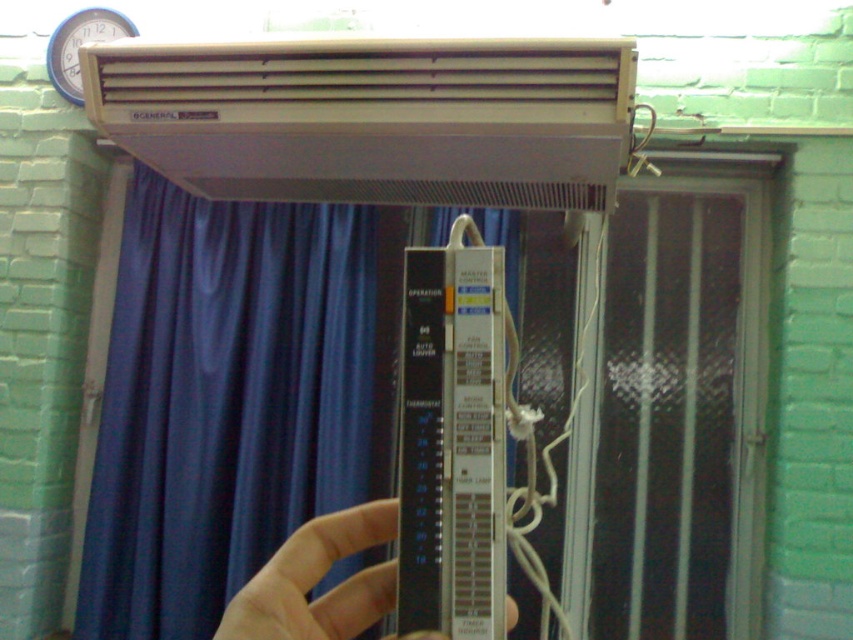
You are standing in the room and want to adjust the thermostat control device. Which object, the beige plastic air conditioner at upper center or the slightly translucent plastic at center, is closer to you?

The beige plastic air conditioner at upper center is closer to you because it is further to the viewer than the slightly translucent plastic at center.

You are standing in the room and want to adjust the air conditioning unit above the window. To do so, you need to move the blue satin curtain at center. Is the curtain in a position that allows you to reach the air conditioning unit?

The blue satin curtain at center is positioned at point (231, 397), which is partially covering the window and the air conditioning unit above it. Moving the curtain would allow access to the air conditioning unit.

Based on the photo, you are standing in the room and want to adjust the air conditioner. You notice the blue satin curtain at center and the beige plastic air conditioner at upper center. Which object is wider?

The blue satin curtain at center is wider than the beige plastic air conditioner at upper center.